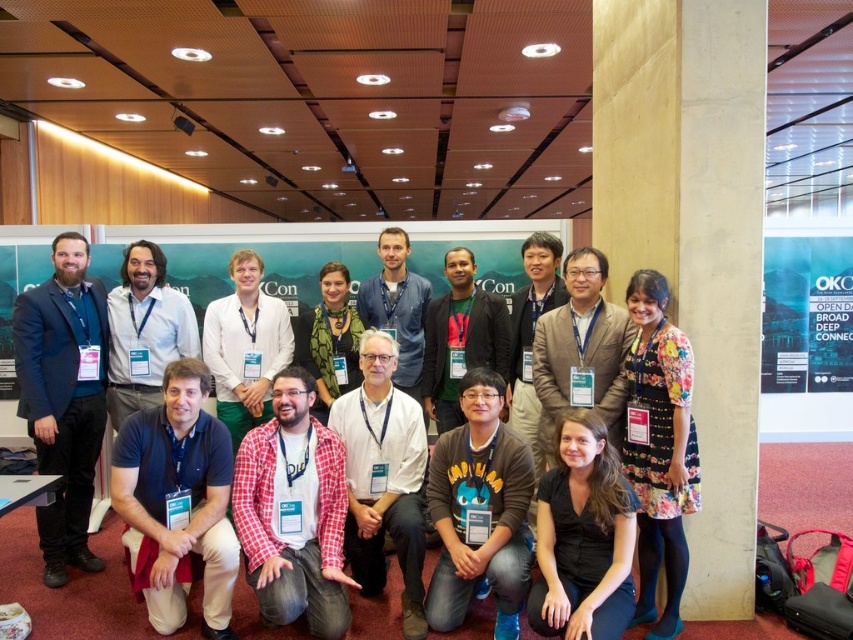
Question: Does dark blue suit at left have a larger size compared to white shirt at center?

Choices:
 (A) no
 (B) yes

Answer: (B)

Question: Which of these objects is positioned farthest from the green fabric banner at upper center?

Choices:
 (A) matte white shirt at center
 (B) light brown textured blazer at center
 (C) green fabric shirt at center
 (D) black matte shirt at lower center

Answer: (D)

Question: Among these objects, which one is nearest to the camera?

Choices:
 (A) black matte shirt at lower center
 (B) green fabric shirt at center
 (C) white shirt at center

Answer: (A)

Question: Is dark blue suit at left positioned behind green textured sweater at center?

Choices:
 (A) no
 (B) yes

Answer: (A)

Question: Which object is the farthest from the dark blue suit at left?

Choices:
 (A) green textured sweater at center
 (B) floral dress at lower right
 (C) black matte shirt at lower center

Answer: (B)

Question: Is floral dress at lower right further to camera compared to green textured sweater at center?

Choices:
 (A) yes
 (B) no

Answer: (B)